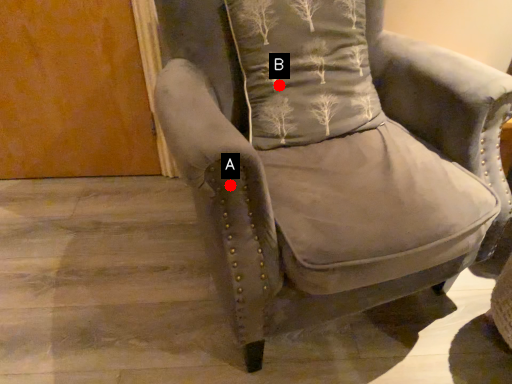
Question: Two points are circled on the image, labeled by A and B beside each circle. Among these points, which one is farthest from the camera?

Choices:
 (A) A is further
 (B) B is further

Answer: (B)